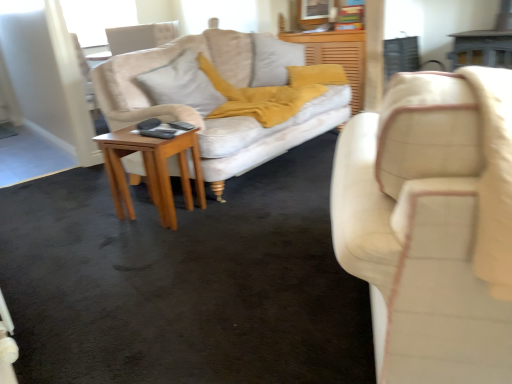
Question: Is light gray fabric pillow at center not near wooden dresser at center?

Choices:
 (A) yes
 (B) no

Answer: (A)

Question: Is the position of light gray fabric pillow at center less distant than that of wooden dresser at center?

Choices:
 (A) no
 (B) yes

Answer: (B)

Question: Does light gray fabric pillow at center have a lesser height compared to wooden dresser at center?

Choices:
 (A) yes
 (B) no

Answer: (A)

Question: Can you confirm if light gray fabric pillow at center is smaller than wooden dresser at center?

Choices:
 (A) no
 (B) yes

Answer: (A)

Question: From a real-world perspective, is light gray fabric pillow at center under wooden dresser at center?

Choices:
 (A) no
 (B) yes

Answer: (A)

Question: Is light gray fabric pillow at center beside wooden dresser at center?

Choices:
 (A) no
 (B) yes

Answer: (A)

Question: Is matte cream studio couch at right thinner than light brown wooden side table at center?

Choices:
 (A) yes
 (B) no

Answer: (B)

Question: From a real-world perspective, is matte cream studio couch at right on light brown wooden side table at center?

Choices:
 (A) no
 (B) yes

Answer: (B)

Question: Is matte cream studio couch at right with light brown wooden side table at center?

Choices:
 (A) no
 (B) yes

Answer: (A)

Question: Considering the relative sizes of matte cream studio couch at right and light brown wooden side table at center in the image provided, is matte cream studio couch at right smaller than light brown wooden side table at center?

Choices:
 (A) yes
 (B) no

Answer: (B)

Question: From a real-world perspective, is matte cream studio couch at right below light brown wooden side table at center?

Choices:
 (A) no
 (B) yes

Answer: (A)

Question: Is matte cream studio couch at right outside light brown wooden side table at center?

Choices:
 (A) yes
 (B) no

Answer: (A)

Question: Considering the relative sizes of light brown wooden side table at center and matte cream studio couch at right in the image provided, is light brown wooden side table at center smaller than matte cream studio couch at right?

Choices:
 (A) no
 (B) yes

Answer: (B)